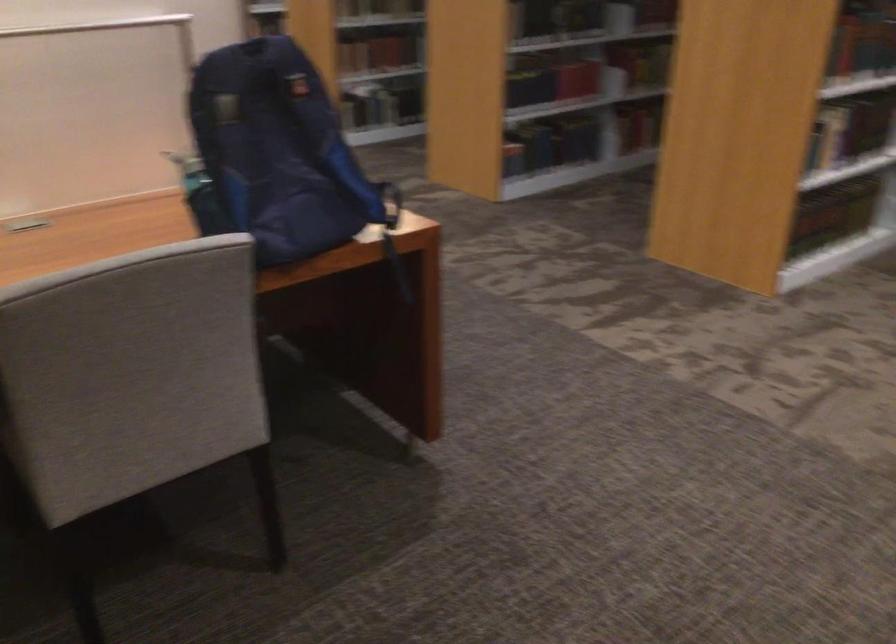
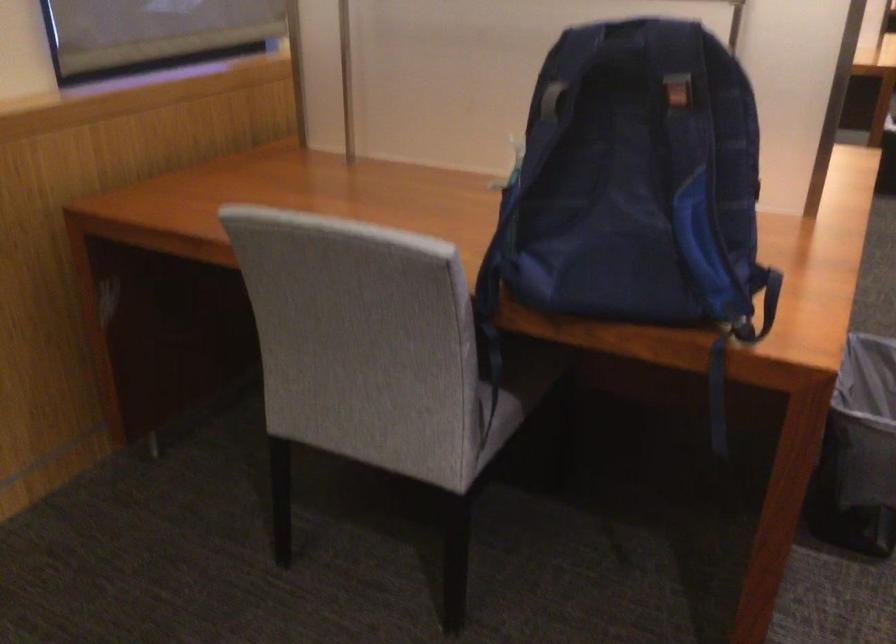
Where in the second image is the point corresponding to (x=229, y=108) from the first image?

(552, 100)